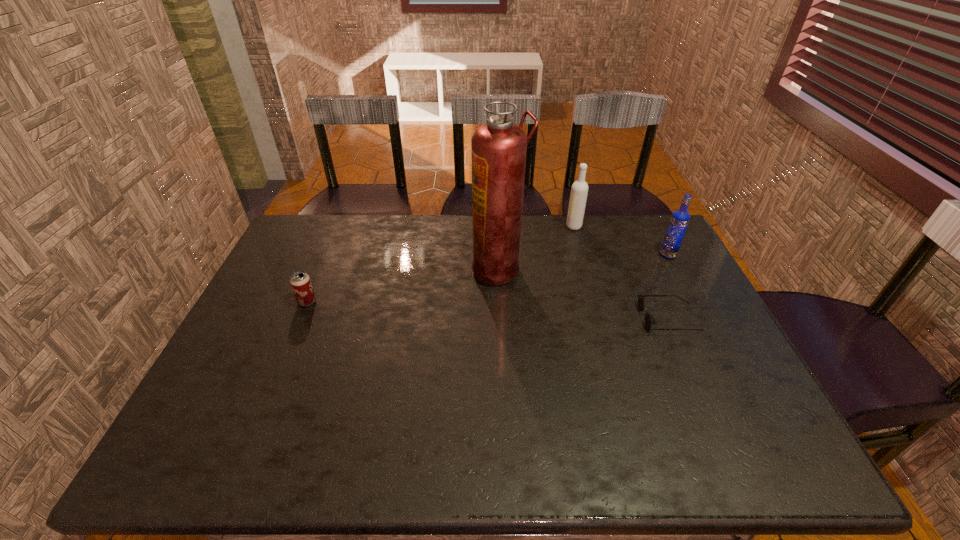
Find the location of a particular element. The height and width of the screenshot is (540, 960). free point between the shortest object and the leftmost object is located at coordinates (488, 310).

Image resolution: width=960 pixels, height=540 pixels. I want to click on unoccupied area between the sunglasses and the right vodka, so click(x=668, y=287).

Where is `vacant point located between the farthest object and the fourth object from right to left`? This screenshot has width=960, height=540. vacant point located between the farthest object and the fourth object from right to left is located at coordinates (536, 248).

Where is `empty space between the beer can and the third object from left to right`? The height and width of the screenshot is (540, 960). empty space between the beer can and the third object from left to right is located at coordinates (441, 264).

Where is `unoccupied area between the third object from left to right and the fourth tallest object`? This screenshot has width=960, height=540. unoccupied area between the third object from left to right and the fourth tallest object is located at coordinates (441, 264).

Select which object appears as the fourth closest to the nearer vodka. Please provide its 2D coordinates. Your answer should be formatted as a tuple, i.e. [(x, y)], where the tuple contains the x and y coordinates of a point satisfying the conditions above.

[(300, 282)]

Identify which object is located as the fourth nearest to the shortest object. Please provide its 2D coordinates. Your answer should be formatted as a tuple, i.e. [(x, y)], where the tuple contains the x and y coordinates of a point satisfying the conditions above.

[(300, 282)]